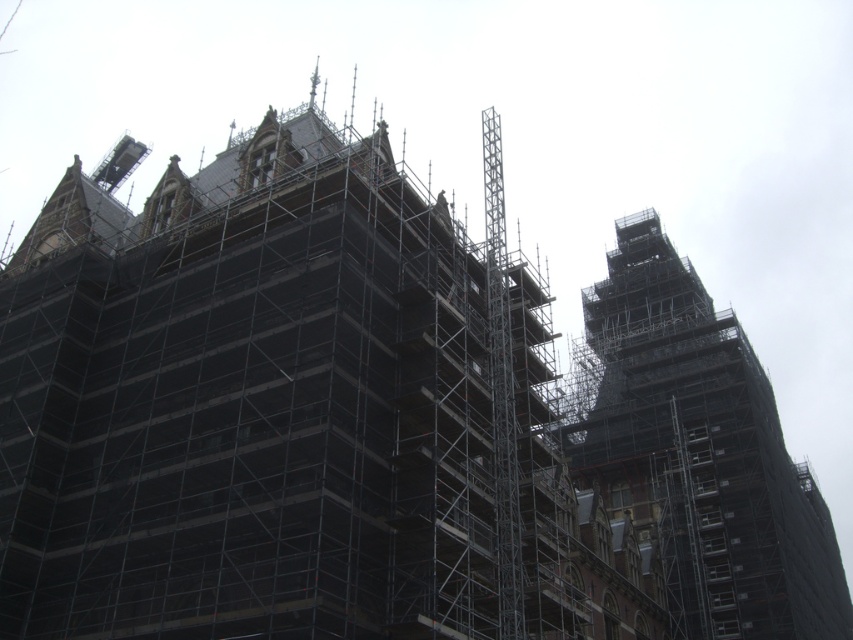
Question: Which point is closer to the camera?

Choices:
 (A) black scaffolding at center
 (B) metal scaffolding at center

Answer: (B)

Question: Does metal scaffolding at center appear on the left side of black scaffolding at center?

Choices:
 (A) no
 (B) yes

Answer: (B)

Question: Which of the following is the farthest from the observer?

Choices:
 (A) (793, 500)
 (B) (474, 406)

Answer: (A)

Question: Is metal scaffolding at center thinner than black scaffolding at center?

Choices:
 (A) yes
 (B) no

Answer: (A)

Question: Which of the following is the farthest from the observer?

Choices:
 (A) metal scaffolding at center
 (B) black scaffolding at center

Answer: (B)

Question: From the image, what is the correct spatial relationship of metal scaffolding at center in relation to black scaffolding at center?

Choices:
 (A) below
 (B) above

Answer: (B)